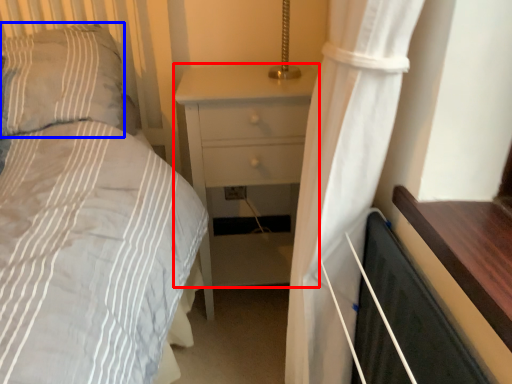
Question: Among these objects, which one is farthest to the camera, nightstand (highlighted by a red box) or pillow (highlighted by a blue box)?

Choices:
 (A) nightstand
 (B) pillow

Answer: (A)